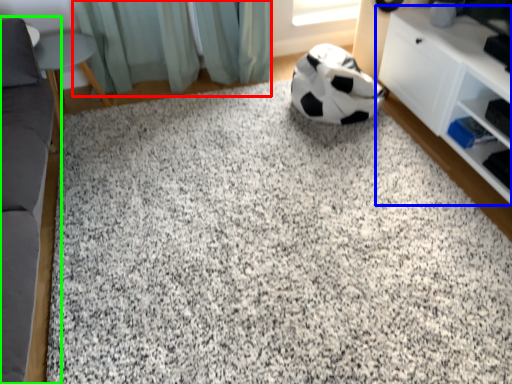
Question: Considering the real-world distances, which object is farthest from curtain (highlighted by a red box)? shelf (highlighted by a blue box) or furniture (highlighted by a green box)?

Choices:
 (A) shelf
 (B) furniture

Answer: (A)